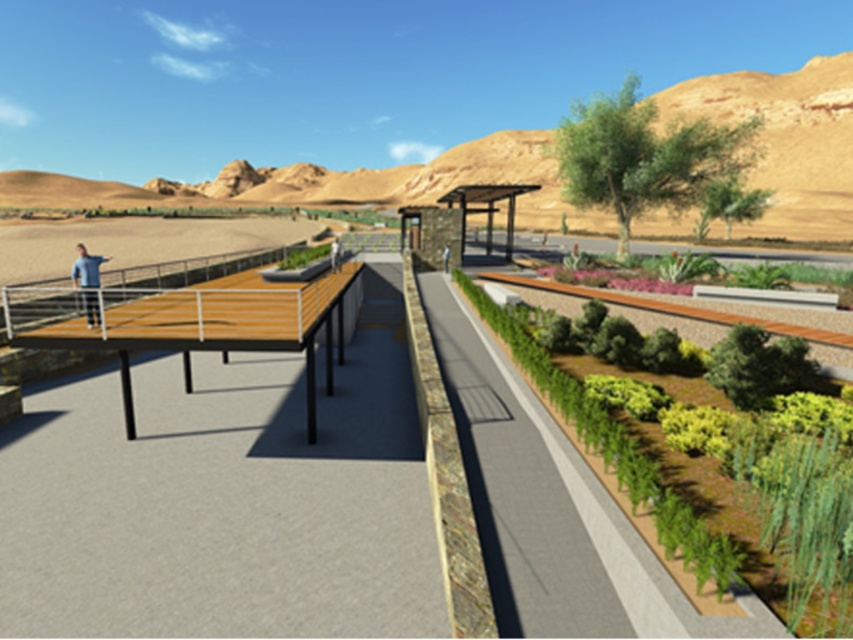
Measure the distance between point (138, 522) and camera.

The distance of point (138, 522) from camera is 25.37 feet.

Which is behind, point (405, 419) or point (86, 276)?

The point (86, 276) is behind.

I want to click on wooden deck at left, so click(x=225, y=497).

Can you confirm if wooden picnic table at left is wider than green leafy shrubs at center right?

Correct, the width of wooden picnic table at left exceeds that of green leafy shrubs at center right.

This screenshot has width=853, height=640. What are the coordinates of `wooden picnic table at left` in the screenshot? It's located at (187, 323).

Describe the element at coordinates (225, 497) in the screenshot. I see `wooden deck at left` at that location.

Identify the location of wooden deck at left. (225, 497).